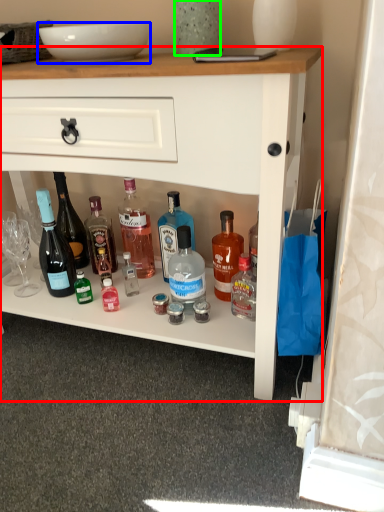
Question: Considering the real-world distances, which object is closest to desk (highlighted by a red box)? bowl (highlighted by a blue box) or glass vase (highlighted by a green box).

Choices:
 (A) bowl
 (B) glass vase

Answer: (A)